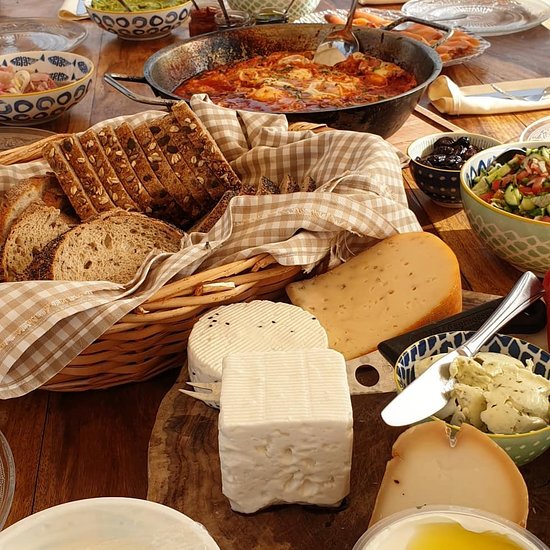
At what (x,y) coordinates should I click in order to perform the action: click on wooden table. Please return your answer as a coordinate pair (x, y). The image size is (550, 550). Looking at the image, I should click on (68, 456).